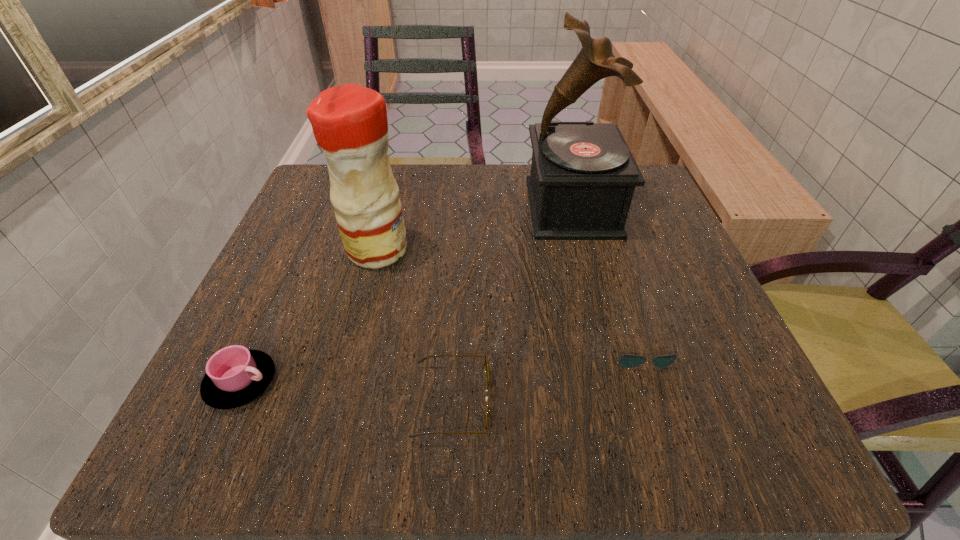
Find the location of a particular element. Image resolution: width=960 pixels, height=540 pixels. phonograph_record located at the right edge is located at coordinates (583, 175).

Identify the location of sunglasses that is at the right edge. (627, 361).

Identify the location of object located in the near left corner section of the desktop. The image size is (960, 540). (235, 376).

Where is `object that is at the far right corner`? This screenshot has width=960, height=540. object that is at the far right corner is located at coordinates (583, 175).

In the image, there is a desktop. Where is `blank space at the far edge`? The image size is (960, 540). blank space at the far edge is located at coordinates (503, 185).

What are the coordinates of `free space at the near edge` in the screenshot? It's located at (584, 443).

Where is `free space at the left edge of the desktop`? This screenshot has height=540, width=960. free space at the left edge of the desktop is located at coordinates (273, 304).

In the image, there is a desktop. Where is `vacant space at the right edge`? vacant space at the right edge is located at coordinates (679, 279).

I want to click on vacant space at the far right corner, so click(659, 218).

The width and height of the screenshot is (960, 540). In the image, there is a desktop. What are the coordinates of `vacant space at the near right corner` in the screenshot? It's located at (747, 418).